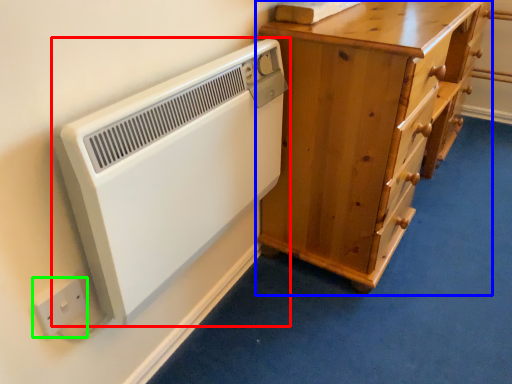
Question: Which object is the closest to the home appliance (highlighted by a red box)? Choose among these: chest of drawers (highlighted by a blue box) or electric outlet (highlighted by a green box).

Choices:
 (A) chest of drawers
 (B) electric outlet

Answer: (B)